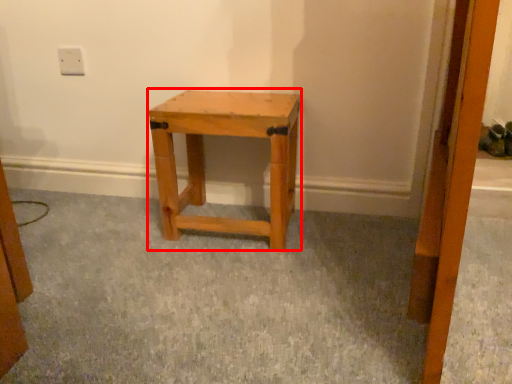
Question: From the image, what is the correct spatial relationship of stool (annotated by the red box) in relation to electric outlet?

Choices:
 (A) left
 (B) right

Answer: (B)